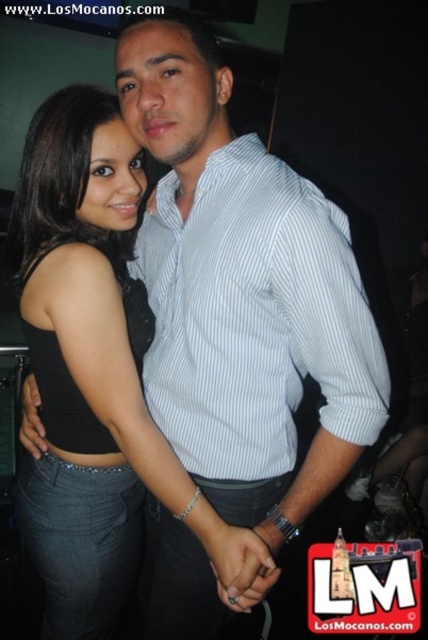
You are at a party and want to take a photo of the two people in the center. The camera you have can only focus on objects above a certain height. Which of the two, the black matte tank top at center or the white striped shirt at center, should you focus on to ensure it is in focus?

The white striped shirt at center is located above the black matte tank top at center, so focusing on the white striped shirt at center would ensure it is within the camera focus range.

You are a photographer trying to capture a closeup shot of both the black matte tank top at center and the white striped shirt at center. The camera lens has a maximum focus range of 7 inches. Can you fit both items within the focus range?

The black matte tank top at center and white striped shirt at center are 8.00 inches apart from each other, which exceeds the camera lens maximum focus range of 7 inches. Therefore, you cannot fit both items within the focus range.

From the picture: You are at a party and want to introduce yourself to the person wearing the white striped shirt at center. Which side should you approach from to avoid blocking the black matte tank top at center?

Since the black matte tank top at center is to the left of the white striped shirt at center, you should approach from the right side of the white striped shirt at center to avoid blocking the black matte tank top at center.